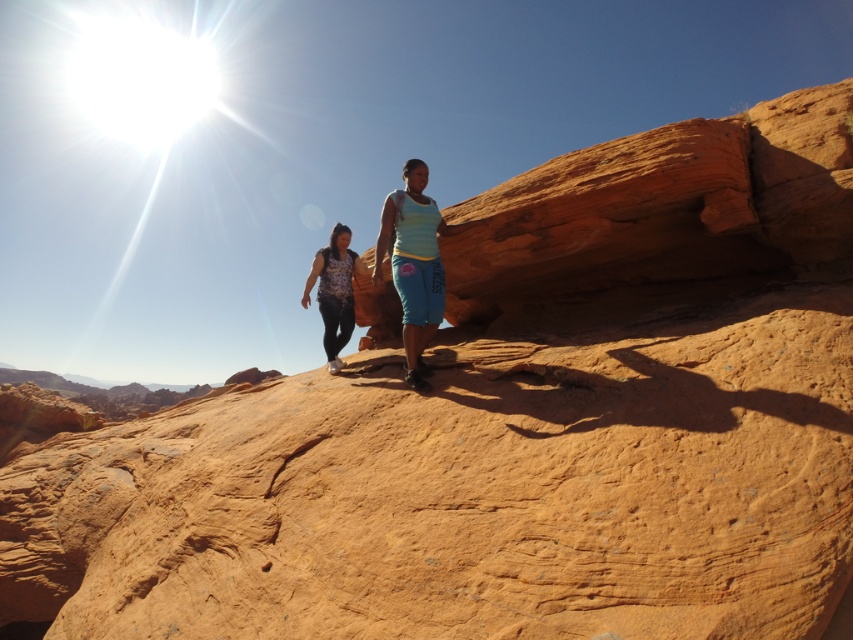
Between point (439, 280) and point (337, 310), which one is positioned behind?

The point (337, 310) is behind.

The height and width of the screenshot is (640, 853). What are the coordinates of `light blue denim shorts at center` in the screenshot? It's located at (415, 264).